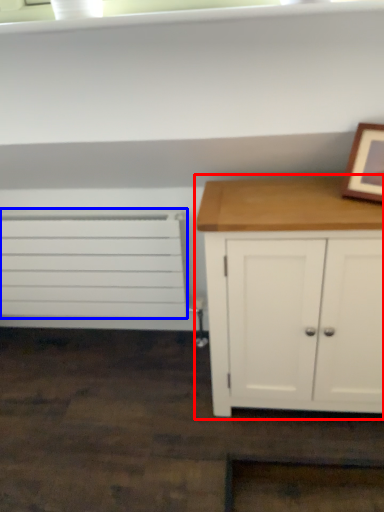
Question: Among these objects, which one is nearest to the camera, chest of drawers (highlighted by a red box) or drawer (highlighted by a blue box)?

Choices:
 (A) chest of drawers
 (B) drawer

Answer: (A)